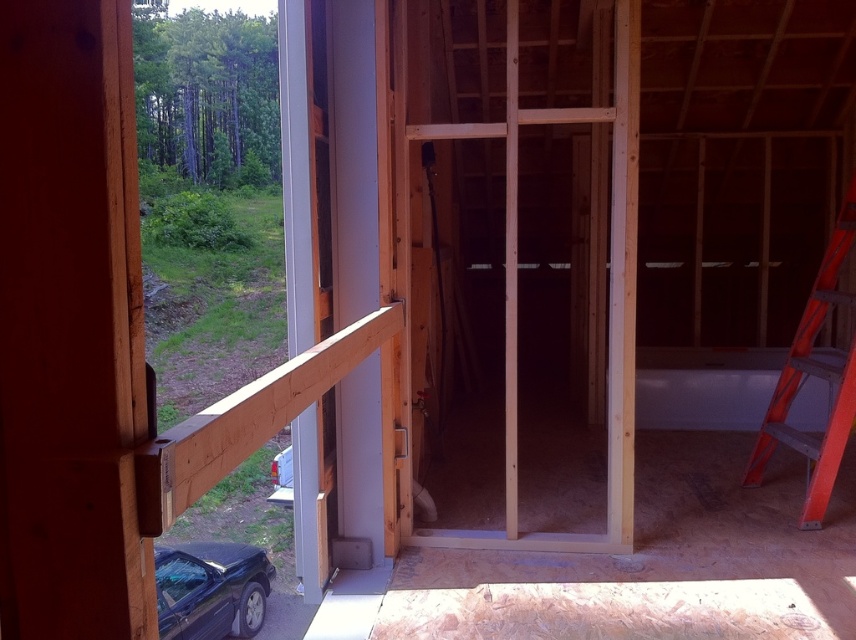
You are a contractor carrying a tool box and need to pass through the doorway into the house. There is a natural wood beam at left and an orange plastic ladder at right in the doorway. Which object has a narrower width that might make it easier for you to navigate around?

The natural wood beam at left has a lesser width compared to orange plastic ladder at right, so it is narrower and might be easier to navigate around.

You are a construction worker carrying a 2.5 meter long steel beam. You need to place it horizontally between the natural wood beam at left and the orange plastic ladder at right. Can the steel beam fit horizontally between them?

The orange plastic ladder at right is taller than the natural wood beam at left. Since the steel beam is 2.5 meters long, it can be placed horizontally between them as the height difference allows for sufficient space.

Based on the photo, you are a contractor carrying a heavy tool box. You need to move from the orange plastic ladder at right to the natural wood beam at left. Is there enough space between them to walk through?

The natural wood beam at left occupies less space than orange plastic ladder at right. However, since the beam is smaller, there might still be enough space to walk between them. But without knowing the exact dimensions of the gap, it is uncertain. Please check the actual distance on site.